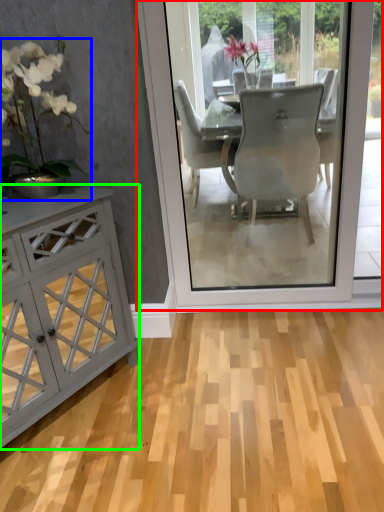
Question: Which is farther away from screen door (highlighted by a red box)? houseplant (highlighted by a blue box) or cabinetry (highlighted by a green box)?

Choices:
 (A) houseplant
 (B) cabinetry

Answer: (A)